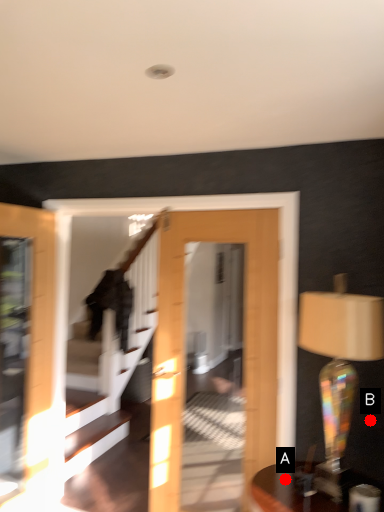
Question: Two points are circled on the image, labeled by A and B beside each circle. Which point is farther from the camera taking this photo?

Choices:
 (A) A is further
 (B) B is further

Answer: (B)